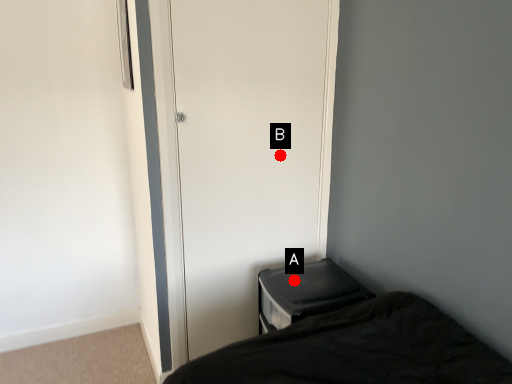
Question: Two points are circled on the image, labeled by A and B beside each circle. Which point is further to the camera?

Choices:
 (A) A is further
 (B) B is further

Answer: (B)